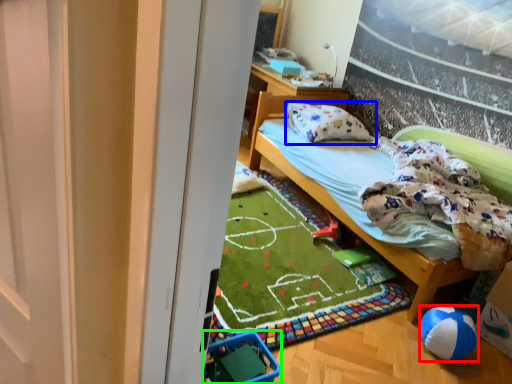
Question: Which object is positioned farthest from ball (highlighted by a red box)? Select from pillow (highlighted by a blue box) and baby carriage (highlighted by a green box).

Choices:
 (A) pillow
 (B) baby carriage

Answer: (A)